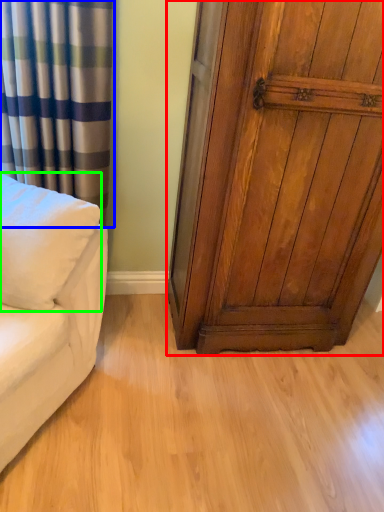
Question: Which object is the closest to the door (highlighted by a red box)? Choose among these: curtain (highlighted by a blue box) or pillow (highlighted by a green box).

Choices:
 (A) curtain
 (B) pillow

Answer: (A)